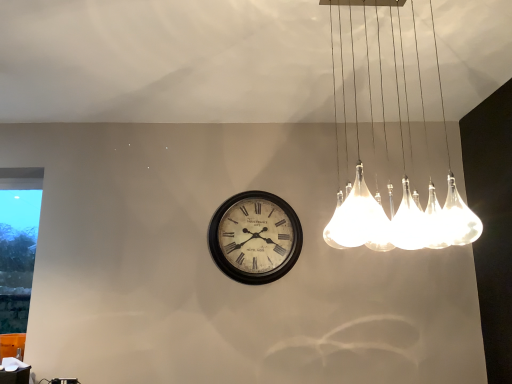
Question: From the image's perspective, is clear glass pendant lights at upper right beneath white matte table at lower left?

Choices:
 (A) yes
 (B) no

Answer: (B)

Question: Can you confirm if clear glass pendant lights at upper right is shorter than white matte table at lower left?

Choices:
 (A) no
 (B) yes

Answer: (A)

Question: Can you confirm if clear glass pendant lights at upper right is bigger than white matte table at lower left?

Choices:
 (A) yes
 (B) no

Answer: (A)

Question: From a real-world perspective, is clear glass pendant lights at upper right beneath white matte table at lower left?

Choices:
 (A) yes
 (B) no

Answer: (B)

Question: From the image's perspective, does clear glass pendant lights at upper right appear higher than white matte table at lower left?

Choices:
 (A) yes
 (B) no

Answer: (A)

Question: Is clear glass pendant lights at upper right at the right side of white matte table at lower left?

Choices:
 (A) yes
 (B) no

Answer: (A)

Question: Is vintage white clock at center positioned beyond the bounds of transparent glass window at left?

Choices:
 (A) no
 (B) yes

Answer: (B)

Question: Is vintage white clock at center to the left of transparent glass window at left from the viewer's perspective?

Choices:
 (A) yes
 (B) no

Answer: (B)

Question: Is vintage white clock at center not near transparent glass window at left?

Choices:
 (A) yes
 (B) no

Answer: (A)

Question: From the image's perspective, is vintage white clock at center on transparent glass window at left?

Choices:
 (A) yes
 (B) no

Answer: (A)

Question: Is vintage white clock at center taller than transparent glass window at left?

Choices:
 (A) yes
 (B) no

Answer: (B)

Question: Is vintage white clock at center at the right side of transparent glass window at left?

Choices:
 (A) no
 (B) yes

Answer: (B)

Question: From a real-world perspective, is vintage white clock at center on white matte table at lower left?

Choices:
 (A) yes
 (B) no

Answer: (A)